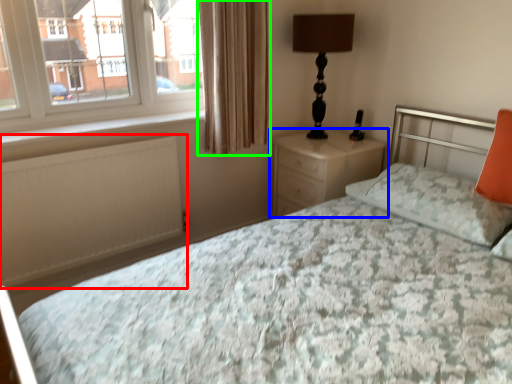
Question: Estimate the real-world distances between objects in this image. Which object is closer to radiator (highlighted by a red box), nightstand (highlighted by a blue box) or curtain (highlighted by a green box)?

Choices:
 (A) nightstand
 (B) curtain

Answer: (B)